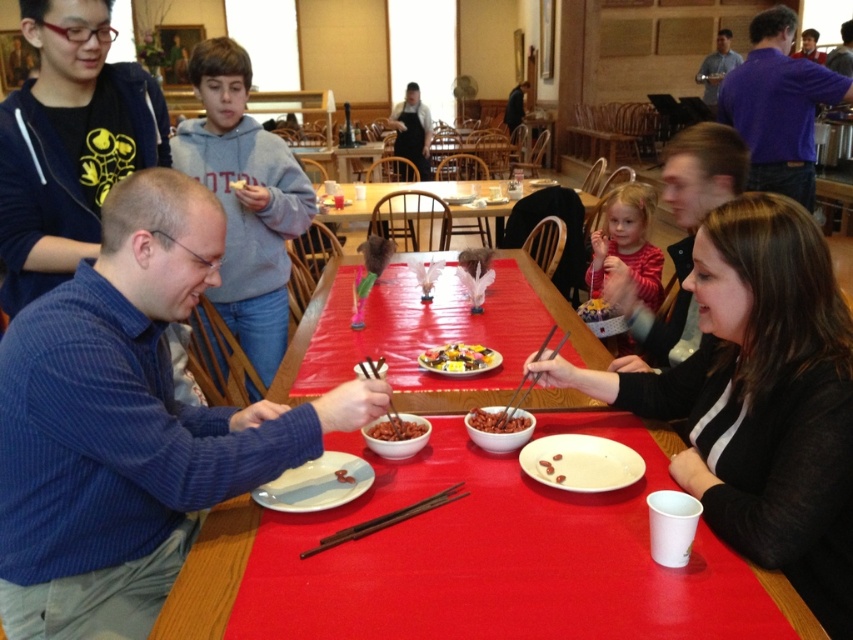
Question: Does matte black hoodie at upper left appear under brown wooden chopsticks at center?

Choices:
 (A) no
 (B) yes

Answer: (A)

Question: Which object is the closest to the purple cotton shirt at upper right?

Choices:
 (A) brown matte beans at center
 (B) smooth red table at center
 (C) wooden table at center
 (D) brown matte nuts at center

Answer: (C)

Question: Which of the following is the closest to the observer?

Choices:
 (A) (279, 340)
 (B) (461, 371)
 (C) (613, 314)

Answer: (B)

Question: Is smooth white plate at center smaller than smooth glossy bowl at center?

Choices:
 (A) no
 (B) yes

Answer: (A)

Question: Is purple cotton shirt at upper right to the left of smooth white plate at lower center from the viewer's perspective?

Choices:
 (A) yes
 (B) no

Answer: (B)

Question: Estimate the real-world distances between objects in this image. Which object is farther from the glossy chocolate cake at center?

Choices:
 (A) smooth glossy bowl at center
 (B) smooth matte brown bowl at center
 (C) brown matte nuts at center
 (D) smooth white plate at lower center

Answer: (C)